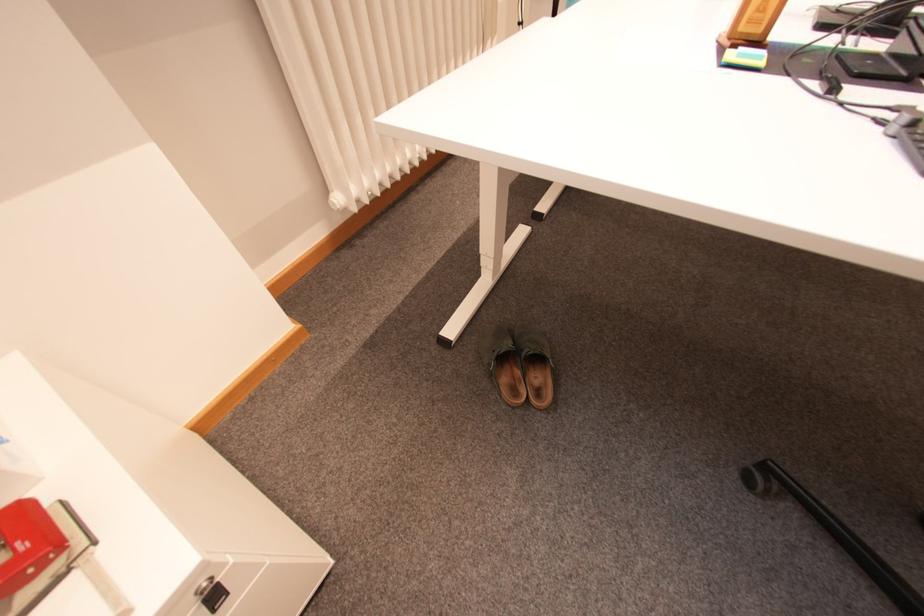
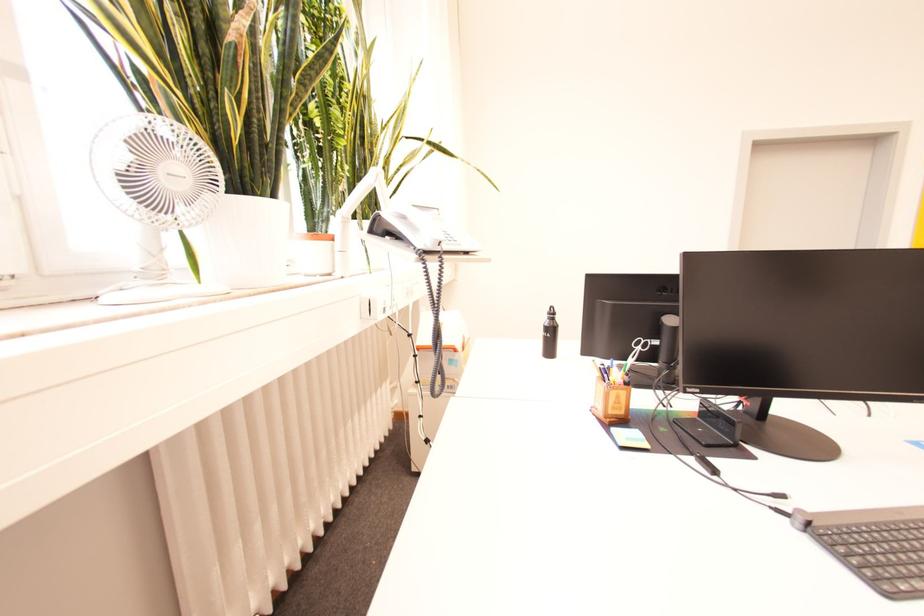
Based on the photo, based on the continuous images, in which direction is the camera rotating?

The rotation direction of the camera is right-up.